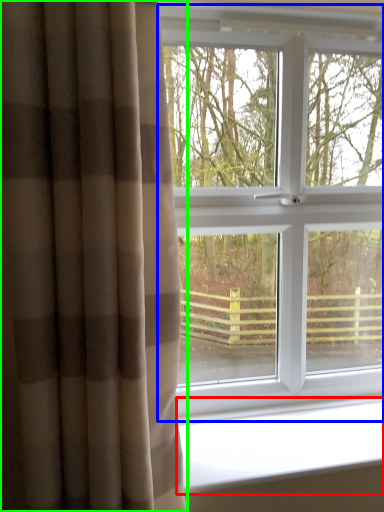
Question: Estimate the real-world distances between objects in this image. Which object is closer to window sill (highlighted by a red box), window (highlighted by a blue box) or curtain (highlighted by a green box)?

Choices:
 (A) window
 (B) curtain

Answer: (A)